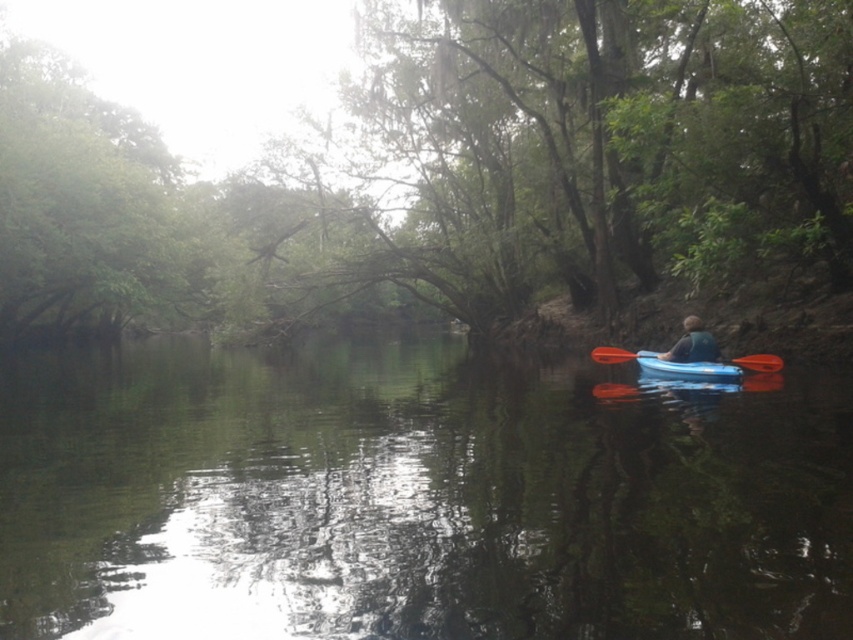
You are a photographer trying to capture the translucent blue kayak at center and orange plastic paddle at center in the same frame. Based on their positions, which object should you adjust your camera to focus on first if you want to include both in your shot?

The translucent blue kayak at center is positioned on the left side of orange plastic paddle at center, so you should focus on the orange plastic paddle at center first to ensure both objects are captured in the frame.

You are planning to cross the river in the blue plastic kayak at right. Considering the width of the kayak and the green matte tree at center, will the kayak fit through a narrow passage between two trees that are spaced 1 meter apart?

The blue plastic kayak at right has a lesser width compared to green matte tree at center. Since the kayak is narrower than the tree, it should fit through the 1 meter passage between the trees.